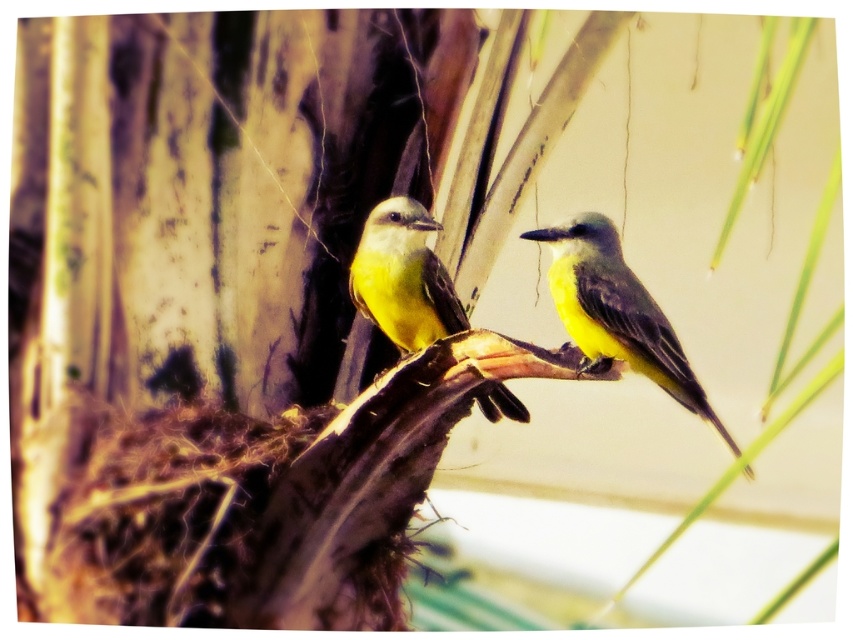
Question: Observing the image, what is the correct spatial positioning of yellow matte bird at center in reference to yellow matte bird at left?

Choices:
 (A) below
 (B) above

Answer: (A)

Question: Which point is farther from the camera taking this photo?

Choices:
 (A) (612, 260)
 (B) (419, 310)

Answer: (B)

Question: Is yellow matte bird at center above yellow matte bird at left?

Choices:
 (A) no
 (B) yes

Answer: (A)

Question: Can you confirm if yellow matte bird at center is smaller than yellow matte bird at left?

Choices:
 (A) yes
 (B) no

Answer: (A)